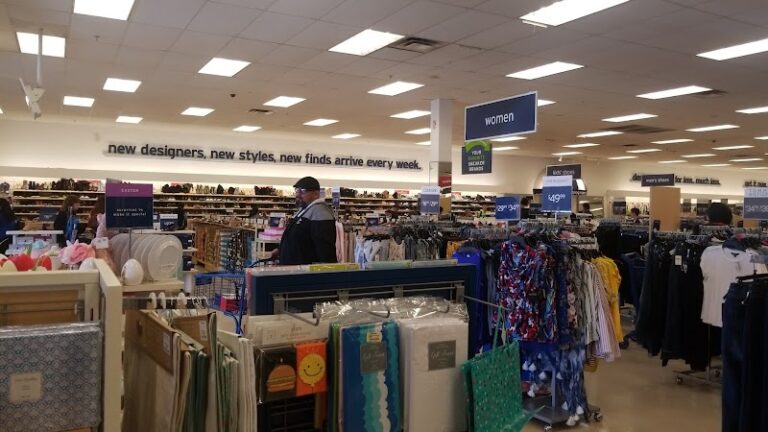
Find the location of a particular element. ceiling is located at coordinates (593, 62).